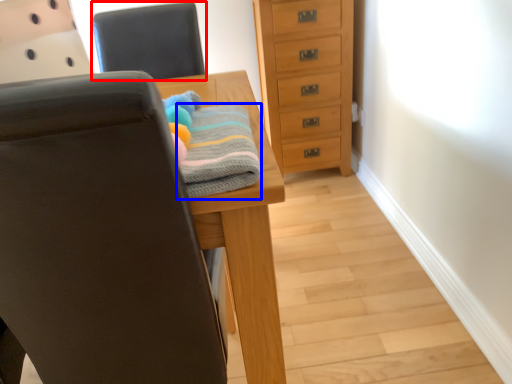
Question: Which point is closer to the camera, chair (highlighted by a red box) or bath towel (highlighted by a blue box)?

Choices:
 (A) chair
 (B) bath towel

Answer: (B)